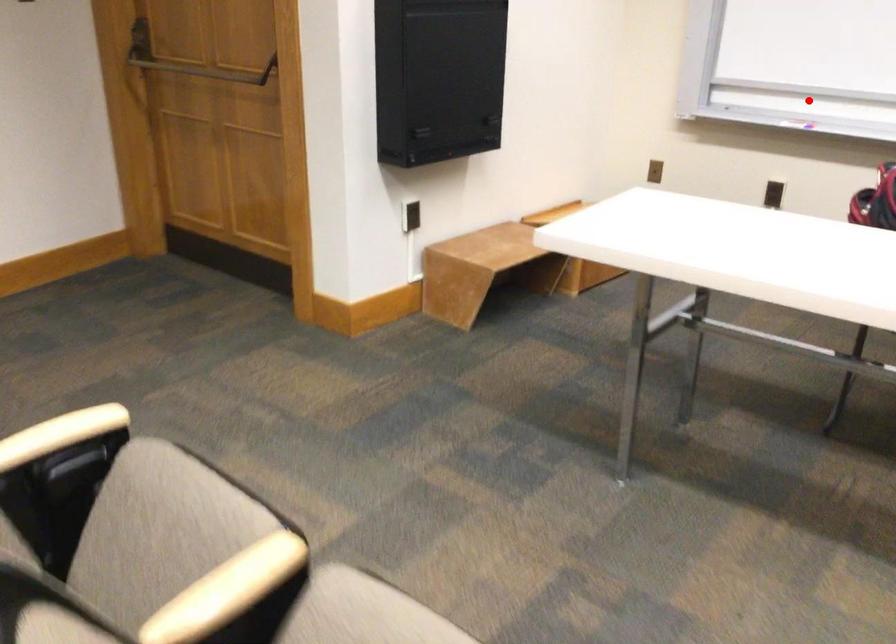
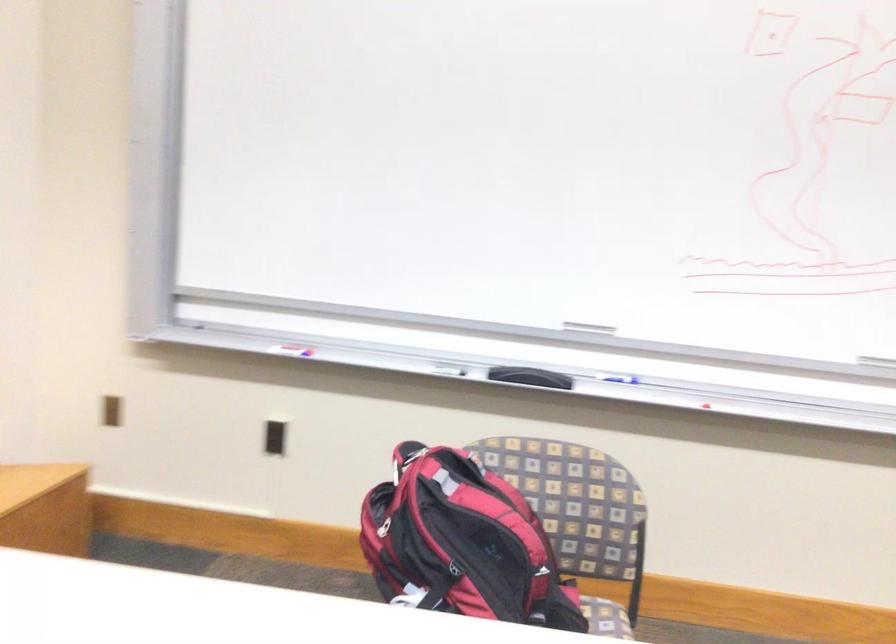
Question: I am providing you with two images of the same scene from different viewpoints. A red point is marked on the first image. At the location where the point appears in image 1, is it still visible in image 2?

Choices:
 (A) Yes
 (B) No

Answer: (A)